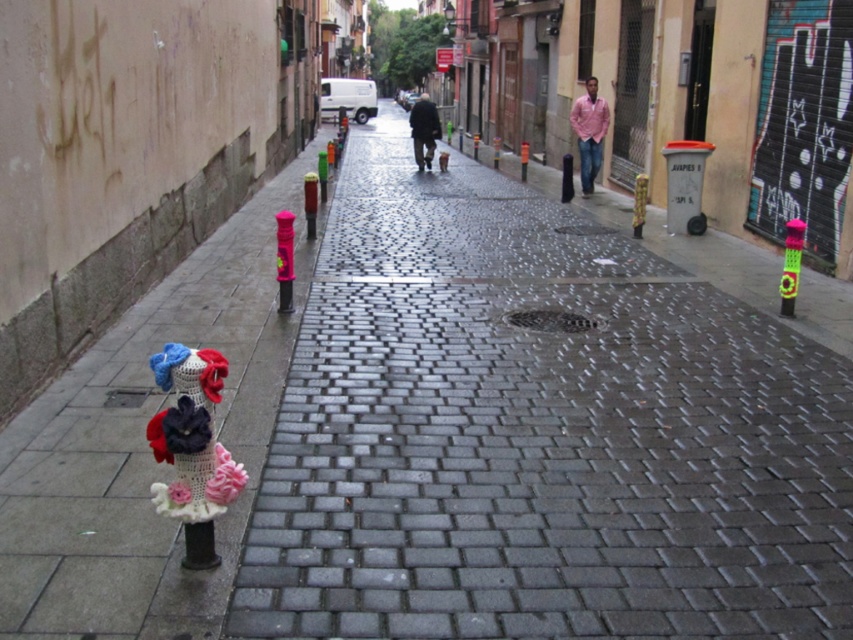
Who is taller, pink plastic hydrant at center or multicolored knitted hydrant at right?

pink plastic hydrant at center

Is pink plastic hydrant at center smaller than multicolored knitted hydrant at right?

Indeed, pink plastic hydrant at center has a smaller size compared to multicolored knitted hydrant at right.

Where is `pink plastic hydrant at center`? The width and height of the screenshot is (853, 640). pink plastic hydrant at center is located at coordinates (283, 259).

The image size is (853, 640). What do you see at coordinates (424, 129) in the screenshot?
I see `dark gray jacket at center` at bounding box center [424, 129].

Who is more distant from viewer, (418, 113) or (570, 198)?

Positioned behind is point (418, 113).

Who is more distant from viewer, (426, 108) or (566, 195)?

Positioned behind is point (426, 108).

The width and height of the screenshot is (853, 640). In order to click on dark gray jacket at center in this screenshot , I will do `click(424, 129)`.

Is point (589, 160) farther from viewer compared to point (799, 234)?

That is True.

Between pink matte shirt at right and neon green plastic pole at center, which one has less height?

neon green plastic pole at center is shorter.

The width and height of the screenshot is (853, 640). What do you see at coordinates (589, 131) in the screenshot? I see `pink matte shirt at right` at bounding box center [589, 131].

Locate an element on the screen. The width and height of the screenshot is (853, 640). pink matte shirt at right is located at coordinates (589, 131).